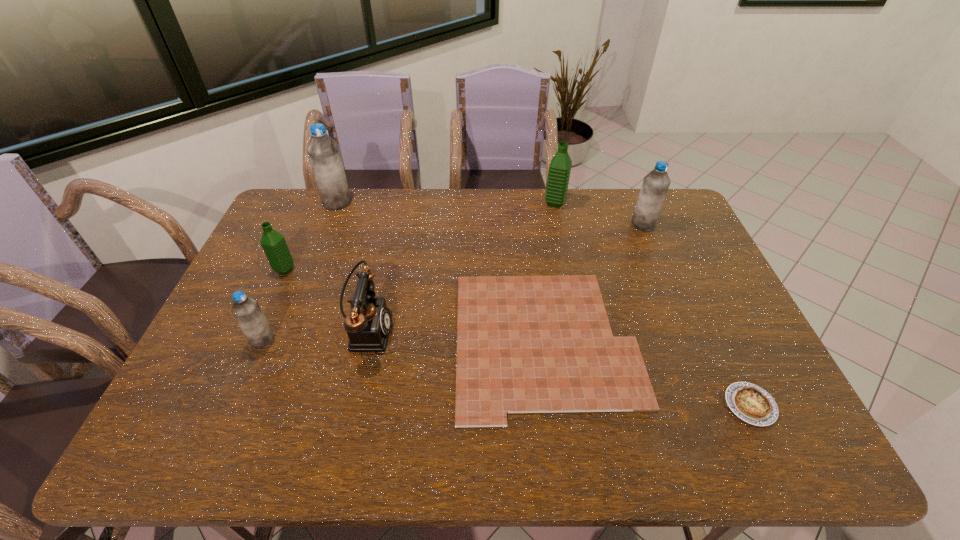
Where is `vacant area at the right edge`? The image size is (960, 540). vacant area at the right edge is located at coordinates (719, 342).

Locate an element on the screen. This screenshot has width=960, height=540. vacant space at the far left corner of the desktop is located at coordinates (320, 212).

Identify the location of vacant area at the near left corner of the desktop. (169, 426).

You are a GUI agent. You are given a task and a screenshot of the screen. Output one action in this format:
    pyautogui.click(x=<x>, y=<y>)
    Task: Click on the blank space at the near right corner
    
    Given the screenshot: What is the action you would take?
    pyautogui.click(x=764, y=457)

Locate an element on the screen. vacant area that lies between the fifth nearest object and the fourth object from left to right is located at coordinates (325, 300).

Locate an element on the screen. free space between the farther green water bottle and the nearest blue water bottle is located at coordinates (409, 272).

Find the location of a particular element. The image size is (960, 540). free spot between the telephone and the second water bottle from right to left is located at coordinates (461, 266).

This screenshot has height=540, width=960. Find the location of `free space between the gameboard and the right green water bottle`. free space between the gameboard and the right green water bottle is located at coordinates (551, 272).

Find the location of `free area in between the farther green water bottle and the seventh tallest object`. free area in between the farther green water bottle and the seventh tallest object is located at coordinates (653, 304).

I want to click on free space between the left green water bottle and the gameboard, so click(416, 306).